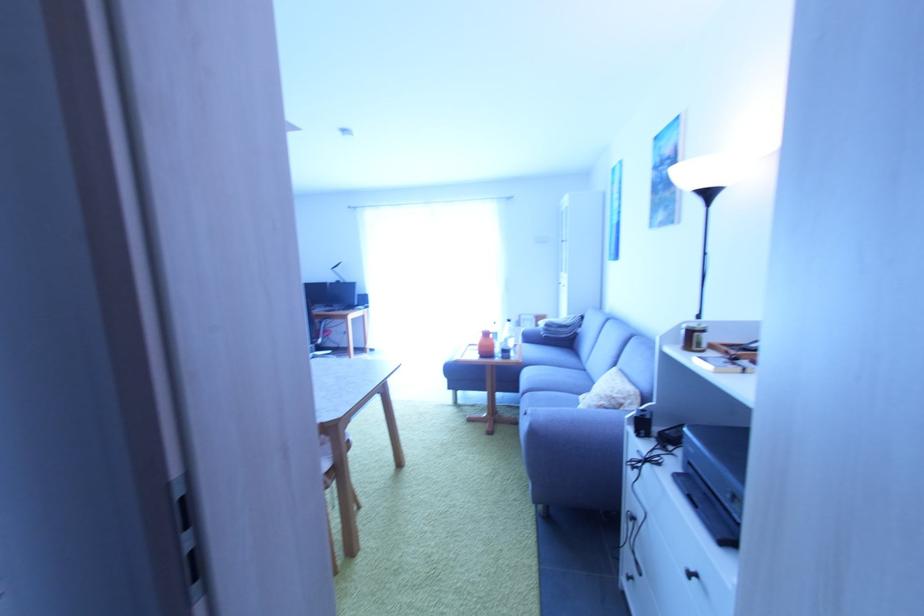
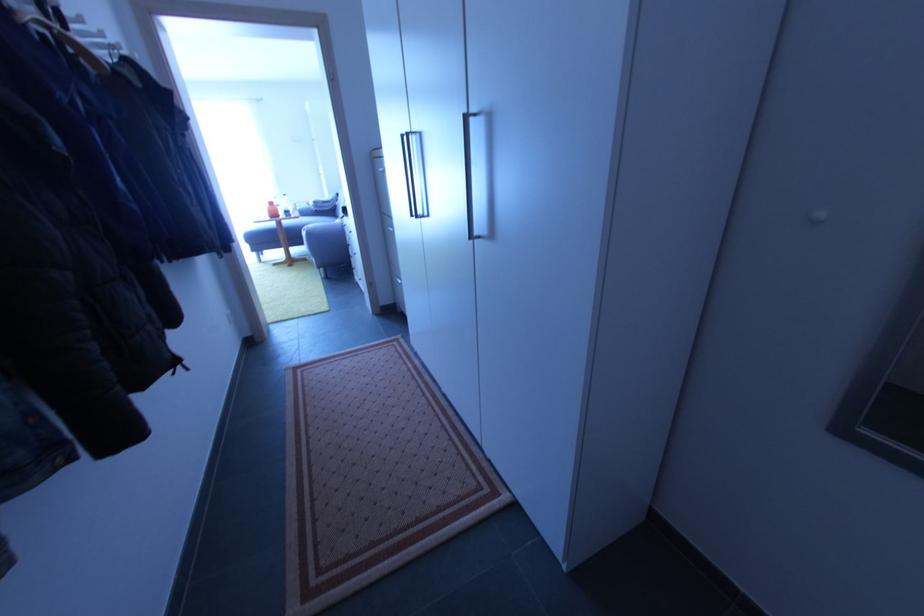
The point at [492,336] is marked in the first image. Where is the corresponding point in the second image?

(275, 205)